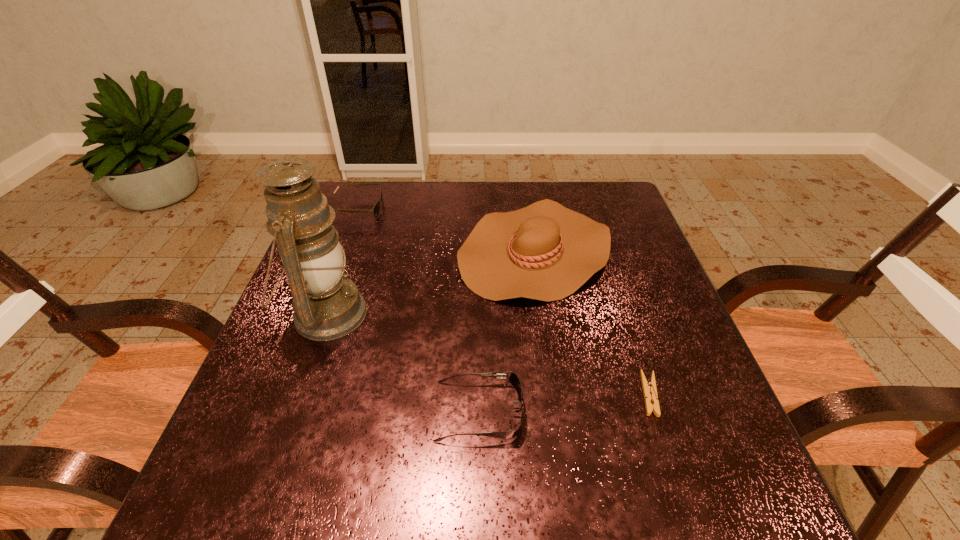
Locate an element on the screen. free space in the image that satisfies the following two spatial constraints: 1. on the lenses of the clothespin; 2. on the left side of the left sunglasses is located at coordinates (286, 394).

I want to click on blank area in the image that satisfies the following two spatial constraints: 1. on the front side of the oil lamp; 2. on the left side of the shortest object, so pyautogui.click(x=299, y=394).

What are the coordinates of `blank area in the image that satisfies the following two spatial constraints: 1. on the lenses of the farther sunglasses; 2. on the left side of the clothespin` in the screenshot? It's located at pos(286,394).

You are a GUI agent. You are given a task and a screenshot of the screen. Output one action in this format:
    pyautogui.click(x=<x>, y=<y>)
    Task: Click on the free region that satisfies the following two spatial constraints: 1. on the front side of the clothespin; 2. on the right side of the second tallest object
    
    Given the screenshot: What is the action you would take?
    pyautogui.click(x=556, y=394)